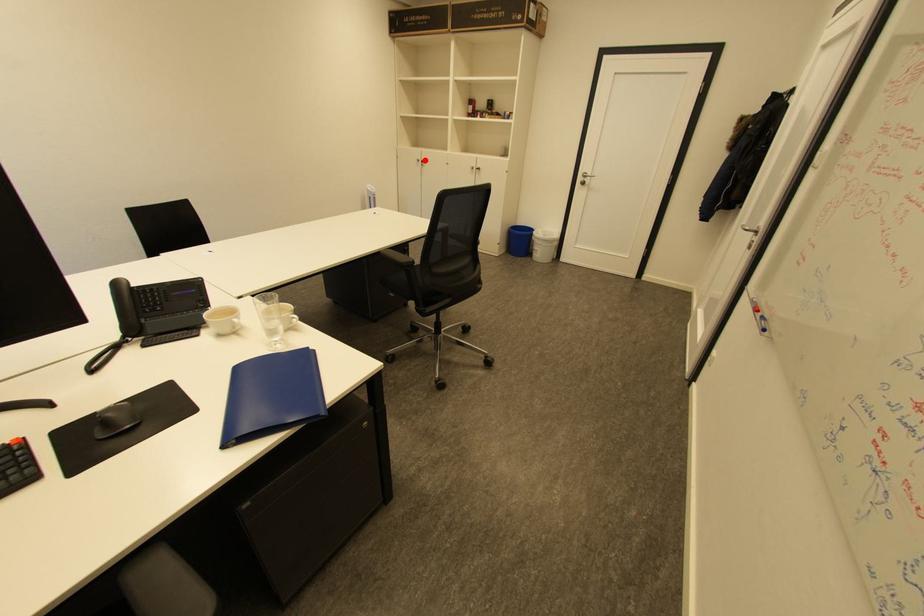
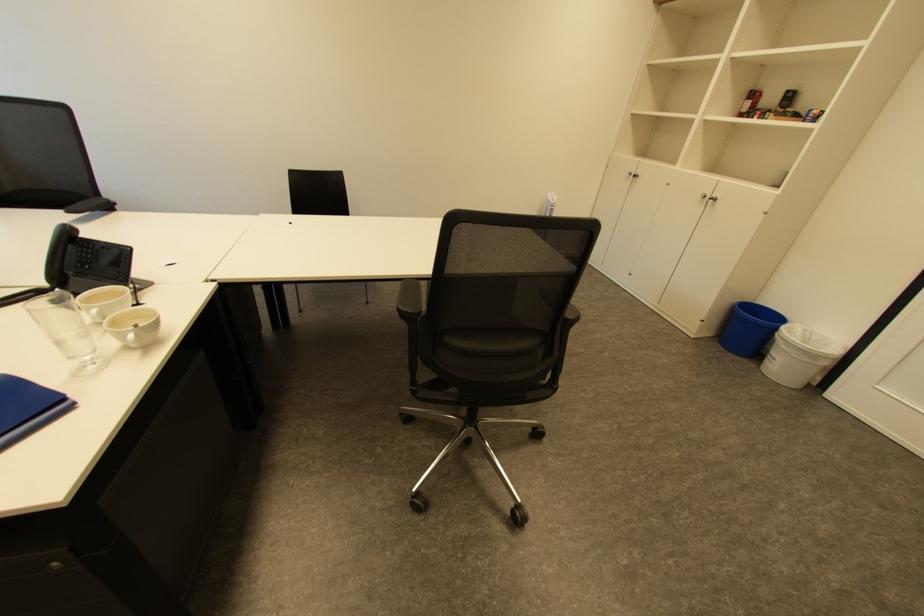
The point at the highlighted location is marked in the first image. Where is the corresponding point in the second image?

(638, 174)